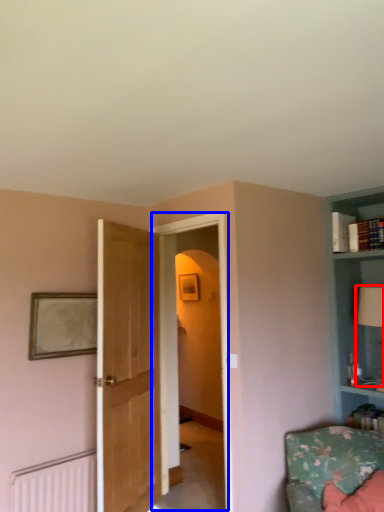
Question: Which object is further to the camera taking this photo, table lamp (highlighted by a red box) or glass door (highlighted by a blue box)?

Choices:
 (A) table lamp
 (B) glass door

Answer: (A)